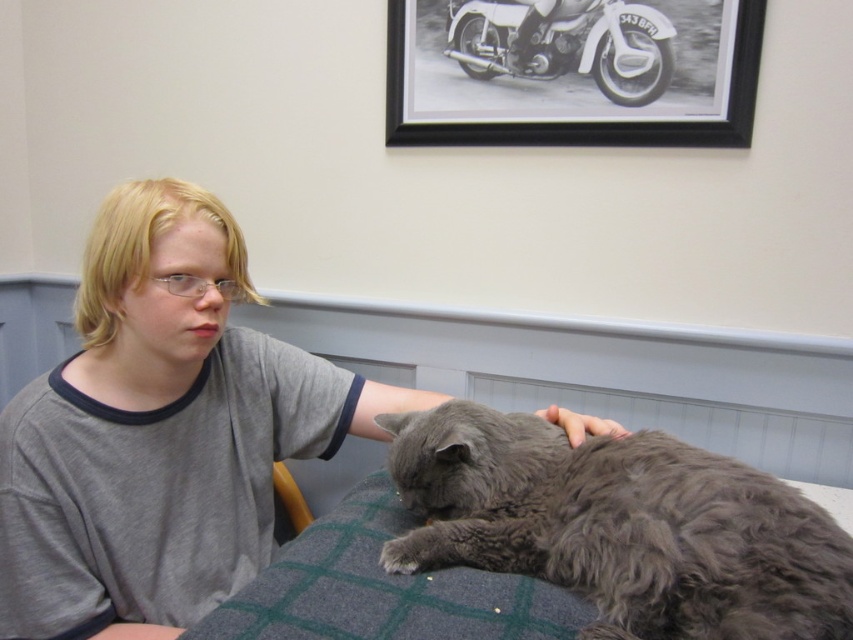
Consider the image. Is gray soft fabric at left to the left of yellow leather chair at lower left from the viewer's perspective?

Correct, you'll find gray soft fabric at left to the left of yellow leather chair at lower left.

Who is more distant from viewer, (39, 396) or (277, 477)?

Point (277, 477)

At what (x,y) coordinates should I click in order to perform the action: click on gray soft fabric at left. Please return your answer as a coordinate pair (x, y). The height and width of the screenshot is (640, 853). Looking at the image, I should click on (154, 488).

Which is below, gray fluffy cat at lower right or yellow leather chair at lower left?

yellow leather chair at lower left

Can you confirm if gray fluffy cat at lower right is positioned below yellow leather chair at lower left?

Incorrect, gray fluffy cat at lower right is not positioned below yellow leather chair at lower left.

Where is `gray fluffy cat at lower right`? gray fluffy cat at lower right is located at coordinates (619, 525).

Where is `gray fluffy cat at lower right`? This screenshot has width=853, height=640. gray fluffy cat at lower right is located at coordinates (619, 525).

Does gray fluffy cat at lower right appear under white matte motorbike at upper center?

Correct, gray fluffy cat at lower right is located below white matte motorbike at upper center.

Does gray fluffy cat at lower right appear on the right side of white matte motorbike at upper center?

In fact, gray fluffy cat at lower right is to the left of white matte motorbike at upper center.

Which is behind, point (676, 477) or point (596, 4)?

Point (596, 4)

Find the location of a particular element. The width and height of the screenshot is (853, 640). gray fluffy cat at lower right is located at coordinates (619, 525).